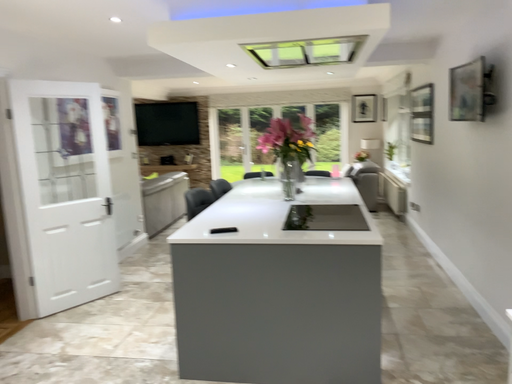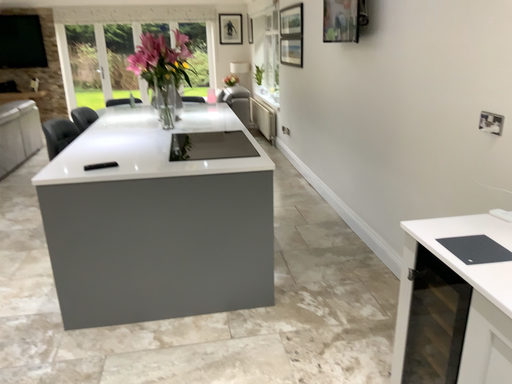
Question: Which way did the camera rotate in the video?

Choices:
 (A) rotated left
 (B) rotated right

Answer: (B)